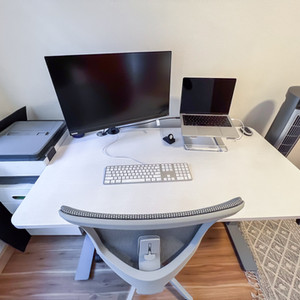
At what (x,y) coordinates should I click in order to perform the action: click on wall. Please return your answer as a coordinate pair (x, y). Looking at the image, I should click on (201, 42).